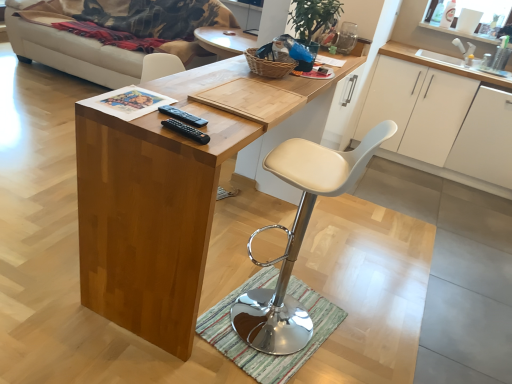
The image size is (512, 384). In order to click on free point to the right of wooden desk at center in this screenshot , I will do `click(378, 310)`.